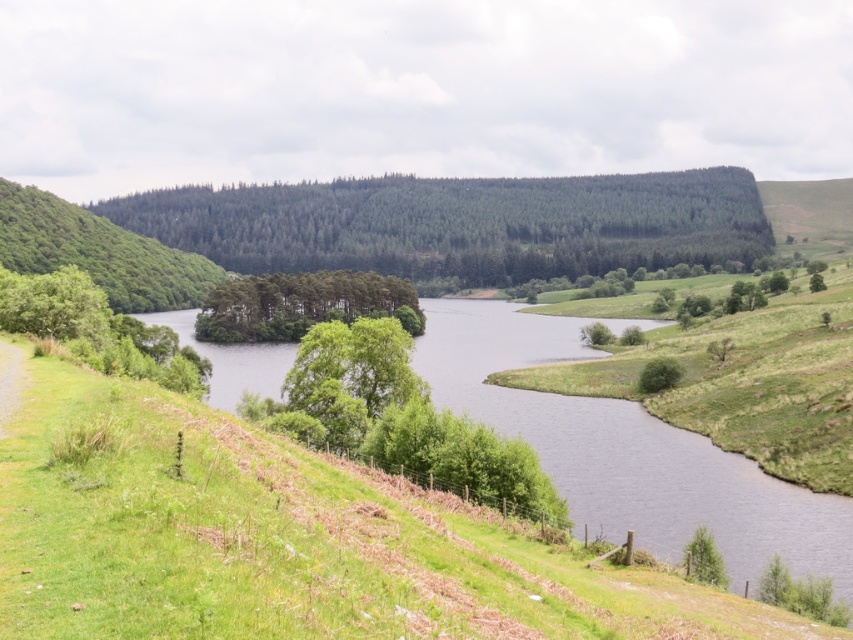
Does green matte tree at lower right have a greater width compared to green leafy tree at center-right?

No.

Is green matte tree at lower right positioned before green leafy tree at center-right?

Yes, green matte tree at lower right is closer to the viewer.

Which is in front, point (711, 552) or point (668, 371)?

Point (711, 552) is more forward.

Locate an element on the screen. Image resolution: width=853 pixels, height=640 pixels. green matte tree at lower right is located at coordinates (705, 557).

Is green textured forest at center taller than green matte tree at lower right?

Yes.

Which is in front, point (724, 228) or point (703, 531)?

Point (703, 531) is more forward.

The height and width of the screenshot is (640, 853). I want to click on green textured forest at center, so click(461, 224).

Does green leafy tree at left have a lesser height compared to green leafy trees at center?

Correct, green leafy tree at left is not as tall as green leafy trees at center.

Which is in front, point (119, 324) or point (299, 280)?

Point (119, 324) is in front.

This screenshot has height=640, width=853. Find the location of `green leafy tree at left`. green leafy tree at left is located at coordinates (96, 326).